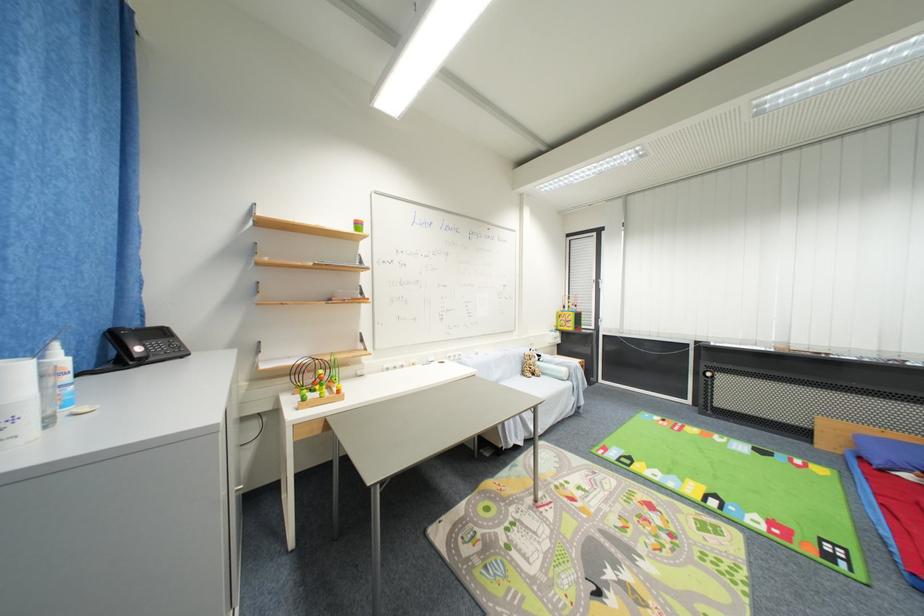
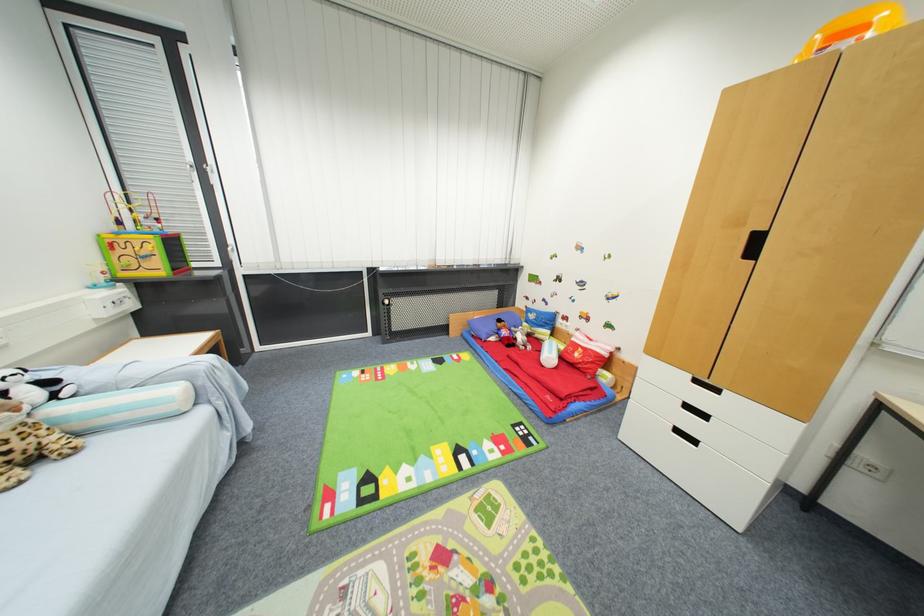
Locate, in the second image, the point that corresponds to (736,509) in the first image.

(479, 455)